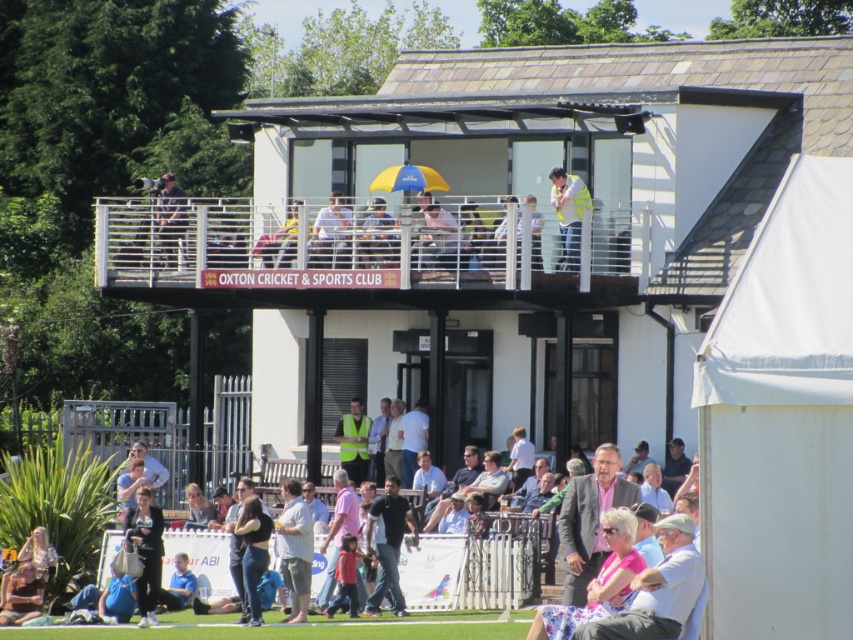
You are a photographer standing on the balcony of the Oxton Cricket Club. You want to capture a photo of the yellow fabric umbrella at upper center without the white metal railing at upper center blocking the view. Is this possible given their sizes?

The white metal railing at upper center is bigger than the yellow fabric umbrella at upper center, so it might block the view of the umbrella if positioned in front. Adjust your angle to frame the umbrella around the railing.

You are a photographer standing on the balcony of the Oxton Cricket Club. You want to take a photo of the matte black jacket at upper center without the white metal railing at upper center blocking the view. Is the railing large enough to cover the jacket if positioned directly in front of it?

The white metal railing at upper center has a larger size compared to matte black jacket at upper center. Therefore, if positioned directly in front, the railing would block the entire jacket from view.